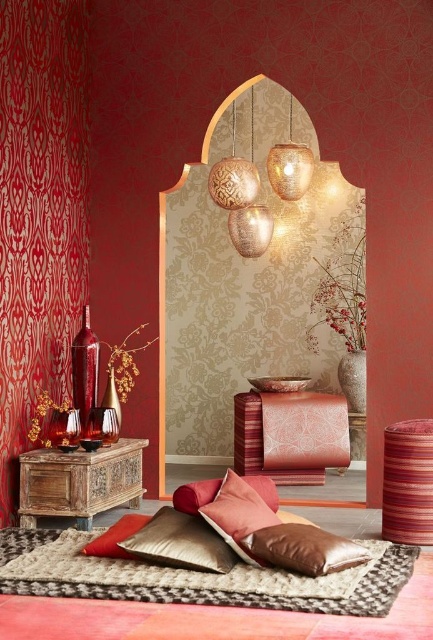
Between point (138, 541) and point (248, 493), which one is positioned in front?

Point (138, 541) is in front.

Is velvet cushion at lower center below velvet cushion at center?

Indeed, velvet cushion at lower center is positioned under velvet cushion at center.

Is point (164, 560) positioned in front of point (244, 515)?

Yes.

The height and width of the screenshot is (640, 433). In order to click on velvet cushion at lower center in this screenshot , I will do `click(180, 541)`.

This screenshot has width=433, height=640. What are the coordinates of `red velvet curtain at left` in the screenshot? It's located at (39, 211).

This screenshot has width=433, height=640. Describe the element at coordinates (39, 211) in the screenshot. I see `red velvet curtain at left` at that location.

This screenshot has height=640, width=433. I want to click on red velvet curtain at left, so click(39, 211).

Is shiny brown pillow at lower center taller than textured brass lamp at upper center?

Incorrect, shiny brown pillow at lower center's height is not larger of textured brass lamp at upper center's.

Who is taller, shiny brown pillow at lower center or textured brass lamp at upper center?

Standing taller between the two is textured brass lamp at upper center.

Which is behind, point (248, 552) or point (249, 179)?

The point (249, 179) is more distant.

The image size is (433, 640). I want to click on shiny brown pillow at lower center, so click(303, 548).